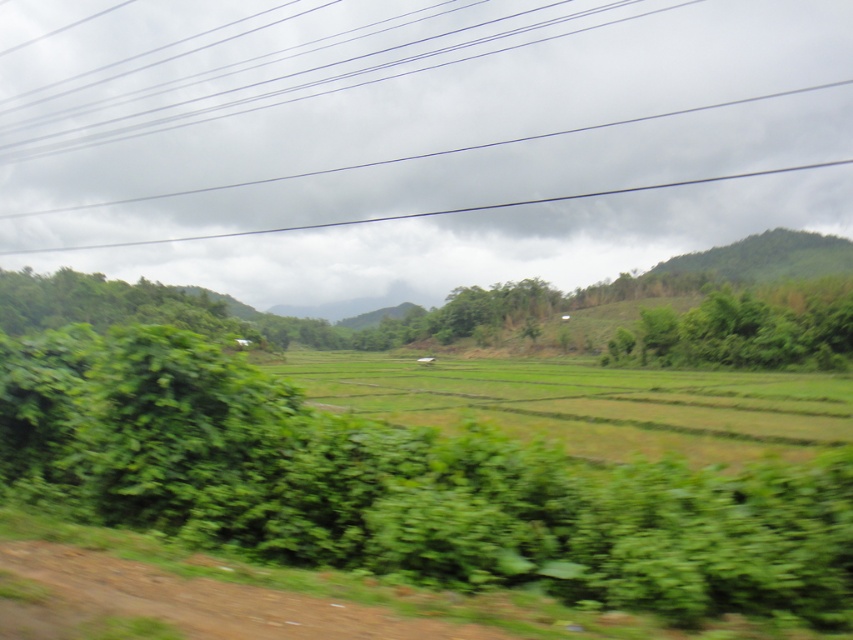
Based on the photo, you are a drone operator tasked with capturing aerial footage of the rural landscape. You notice the black wire at upper center in the image. From your current position, which direction should you adjust your camera to avoid the wire?

The black wire at upper center is located at point [393,106], so you should adjust your camera slightly downward and to the left to avoid it.